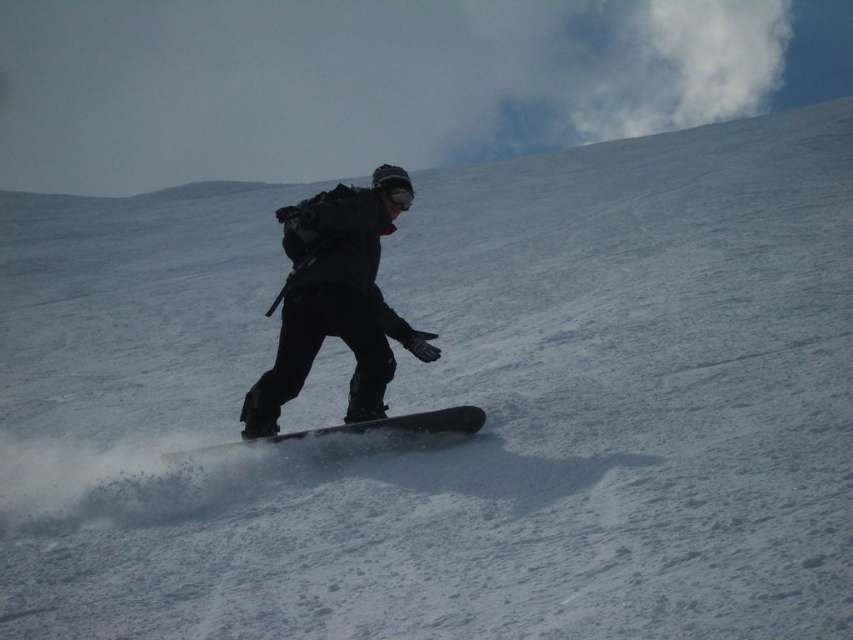
Between black matte snowboarder at center and black matte snowboard at center, which one appears on the left side from the viewer's perspective?

black matte snowboard at center is more to the left.

Between black matte snowboarder at center and black matte snowboard at center, which one has more height?

With more height is black matte snowboarder at center.

Does point (396, 209) lie in front of point (461, 416)?

No.

Find the location of `black matte snowboarder at center`. black matte snowboarder at center is located at coordinates (335, 298).